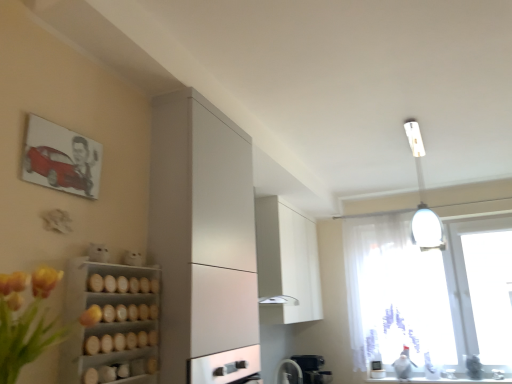
Question: Is white matte cabinet at upper center, which ranks as the first cabinetry in right-to-left order, next to satin white cabinet at left, which is counted as the second cabinetry, starting from the back?

Choices:
 (A) yes
 (B) no

Answer: (B)

Question: Is white matte cabinet at upper center, which appears as the 2th cabinetry when viewed from the left, positioned behind satin white cabinet at left, the first cabinetry viewed from the front?

Choices:
 (A) no
 (B) yes

Answer: (B)

Question: Is white matte cabinet at upper center, positioned as the 2th cabinetry in front-to-back order, far from satin white cabinet at left, which is the second cabinetry in right-to-left order?

Choices:
 (A) no
 (B) yes

Answer: (B)

Question: Is white matte cabinet at upper center, which ranks as the first cabinetry in right-to-left order, positioned before satin white cabinet at left, which is the second cabinetry in right-to-left order?

Choices:
 (A) yes
 (B) no

Answer: (B)

Question: From a real-world perspective, is white matte cabinet at upper center, which is counted as the first cabinetry, starting from the back, over satin white cabinet at left, which is the second cabinetry in right-to-left order?

Choices:
 (A) yes
 (B) no

Answer: (A)

Question: Is satin white cabinet at left, the first cabinetry viewed from the front, surrounded by white matte cabinet at upper center, which appears as the 2th cabinetry when viewed from the left?

Choices:
 (A) yes
 (B) no

Answer: (B)

Question: Considering the relative positions of yellow artificial flowers at left and white glossy counter top at lower right in the image provided, is yellow artificial flowers at left in front of white glossy counter top at lower right?

Choices:
 (A) no
 (B) yes

Answer: (B)

Question: Is yellow artificial flowers at left surrounding white glossy counter top at lower right?

Choices:
 (A) yes
 (B) no

Answer: (B)

Question: Can you confirm if yellow artificial flowers at left is smaller than white glossy counter top at lower right?

Choices:
 (A) no
 (B) yes

Answer: (A)

Question: Does yellow artificial flowers at left have a lesser height compared to white glossy counter top at lower right?

Choices:
 (A) no
 (B) yes

Answer: (A)

Question: From the image's perspective, is yellow artificial flowers at left over white glossy counter top at lower right?

Choices:
 (A) yes
 (B) no

Answer: (A)

Question: Can you confirm if yellow artificial flowers at left is positioned to the left of white glossy counter top at lower right?

Choices:
 (A) yes
 (B) no

Answer: (A)

Question: From a real-world perspective, is white glossy fan at lower center located beneath transparent fabric at right?

Choices:
 (A) no
 (B) yes

Answer: (B)